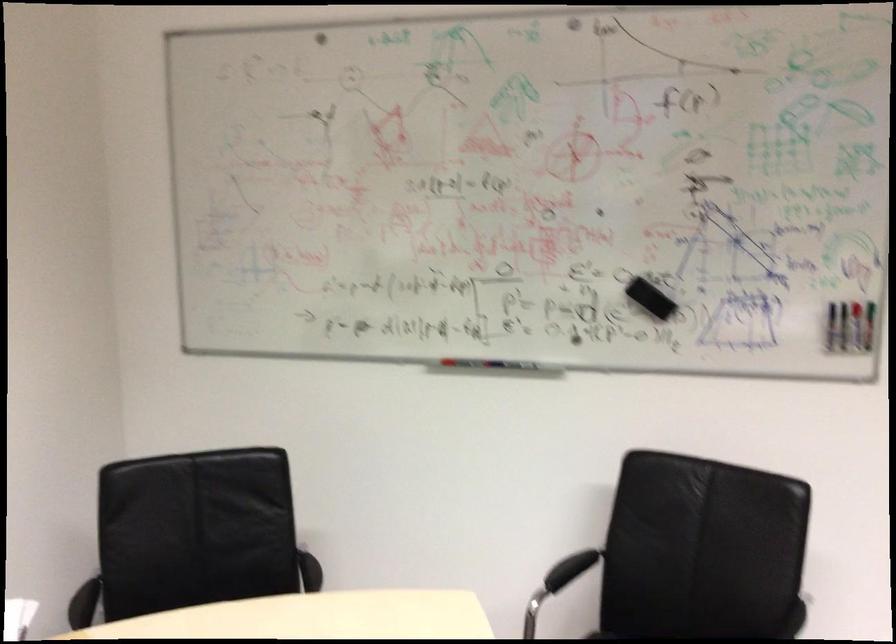
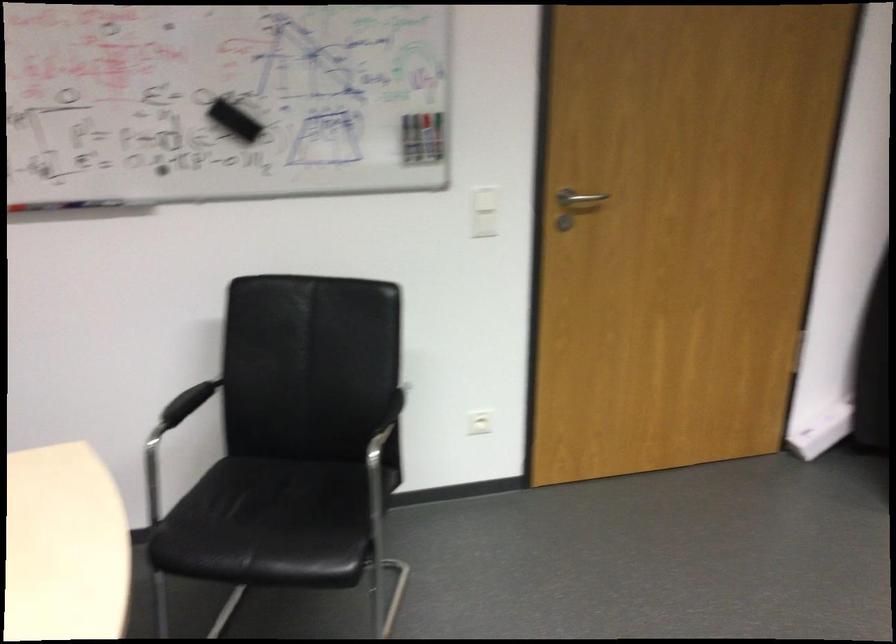
Where in the second image is the point corresponding to (492,357) from the first image?

(65, 203)